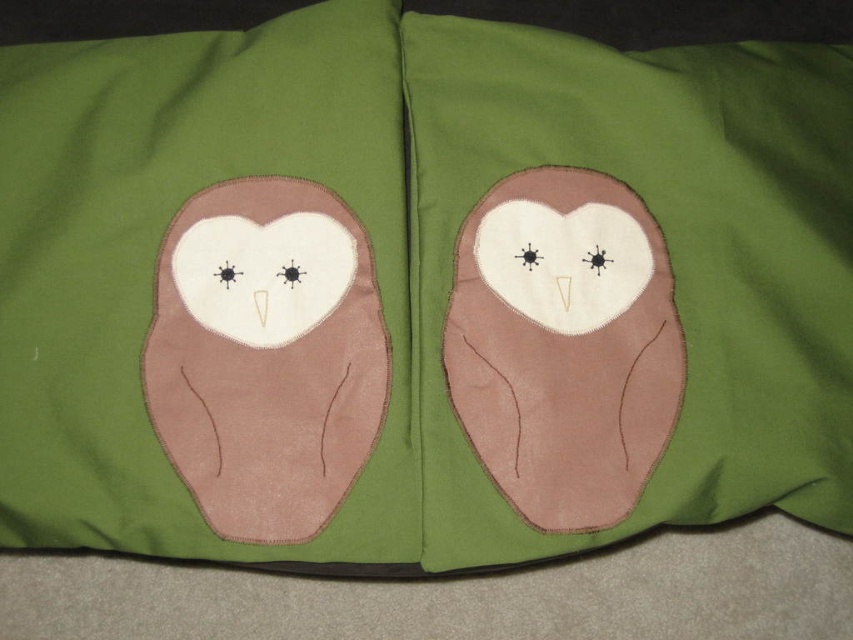
Question: Which point is closer to the camera?

Choices:
 (A) suede brown owl at center
 (B) brown felt owl at left

Answer: (A)

Question: Is suede brown owl at center to the right of brown felt owl at center from the viewer's perspective?

Choices:
 (A) yes
 (B) no

Answer: (B)

Question: Is suede brown owl at center above brown felt owl at left?

Choices:
 (A) yes
 (B) no

Answer: (A)

Question: Is suede brown owl at center closer to camera compared to brown felt owl at left?

Choices:
 (A) yes
 (B) no

Answer: (A)

Question: Estimate the real-world distances between objects in this image. Which object is closer to the brown felt owl at left?

Choices:
 (A) suede brown owl at center
 (B) brown felt owl at center

Answer: (A)

Question: Which point appears farthest from the camera in this image?

Choices:
 (A) (143, 243)
 (B) (519, 358)
 (C) (231, 416)

Answer: (A)